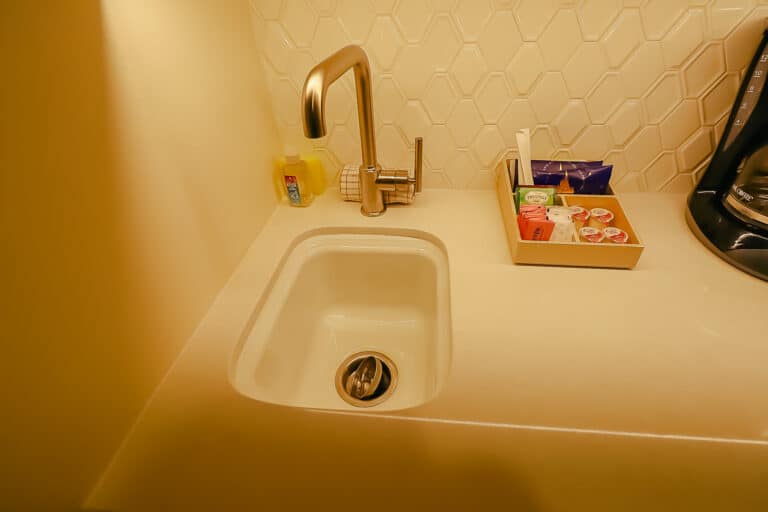
I want to click on wooden holder, so click(560, 252).